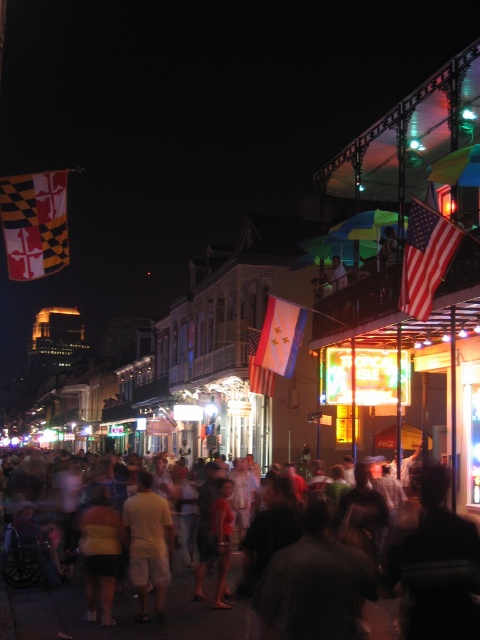
Question: Which is nearer to the light beige shorts at center?

Choices:
 (A) bluematerial/textureflag at center
 (B) blurred human crowd at center
 (C) red and white fabric flag at left
 (D) matte white flag at center

Answer: (B)

Question: Among these points, which one is farthest from the camera?

Choices:
 (A) (172, 632)
 (B) (141, 618)

Answer: (B)

Question: Can you confirm if red and white fabric flag at left is positioned below matte white flag at center?

Choices:
 (A) yes
 (B) no

Answer: (B)

Question: Does bluematerial/textureflag at center have a greater width compared to matte white flag at center?

Choices:
 (A) no
 (B) yes

Answer: (B)

Question: Which is nearer to the bluematerial/textureflag at center?

Choices:
 (A) blurred human crowd at center
 (B) red and white fabric flag at left

Answer: (B)

Question: Where is american flag at upper right located in relation to matte white flag at center in the image?

Choices:
 (A) below
 (B) above

Answer: (B)